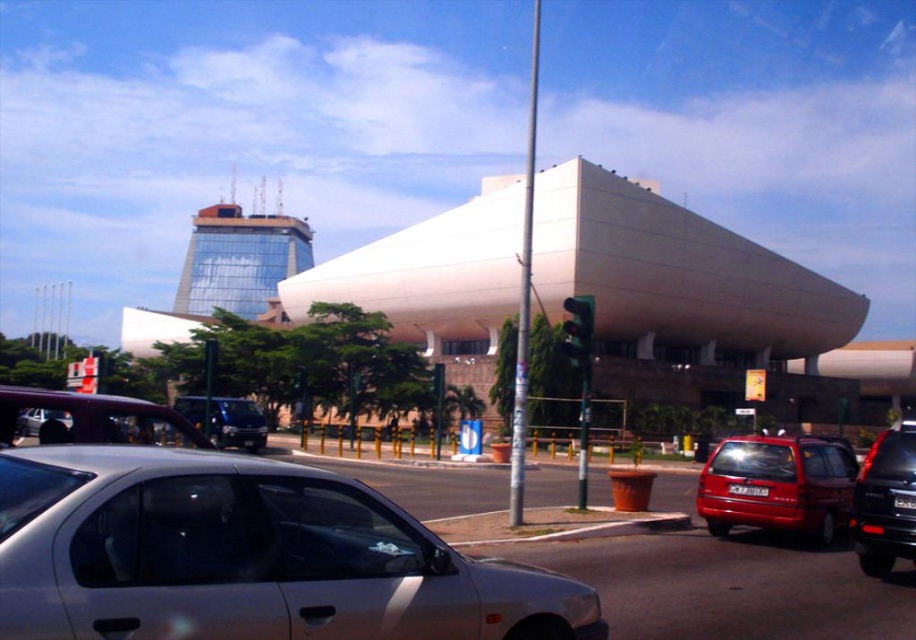
Question: Which point is farther to the camera?

Choices:
 (A) metallic blue van at center
 (B) green glass traffic light at center
 (C) black glass traffic light at center
 (D) black glossy suv at lower right

Answer: (B)

Question: Which point appears farthest from the camera in this image?

Choices:
 (A) (26, 428)
 (B) (325, 582)
 (C) (260, 419)
 (D) (718, 525)

Answer: (C)

Question: Is satin silver sedan at lower left smaller than green glass traffic light at center?

Choices:
 (A) no
 (B) yes

Answer: (A)

Question: Which of the following is the farthest from the observer?

Choices:
 (A) (40, 428)
 (B) (295, 388)
 (C) (900, 528)
 (D) (226, 419)

Answer: (B)

Question: Considering the relative positions of black glossy suv at lower right and silver metallic car at center in the image provided, where is black glossy suv at lower right located with respect to silver metallic car at center?

Choices:
 (A) below
 (B) above

Answer: (A)

Question: Can you confirm if black glass traffic light at center is wider than silver metallic car at center?

Choices:
 (A) no
 (B) yes

Answer: (B)